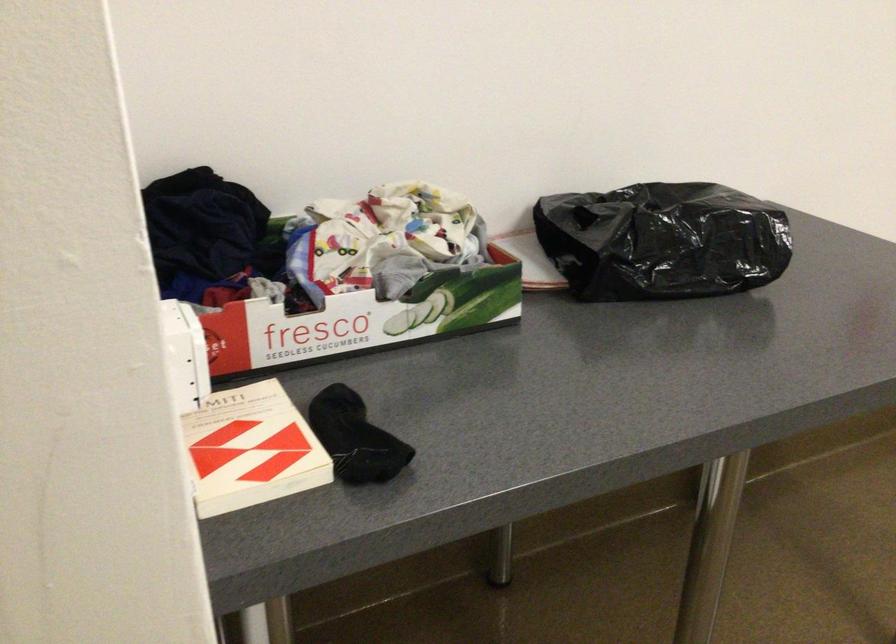
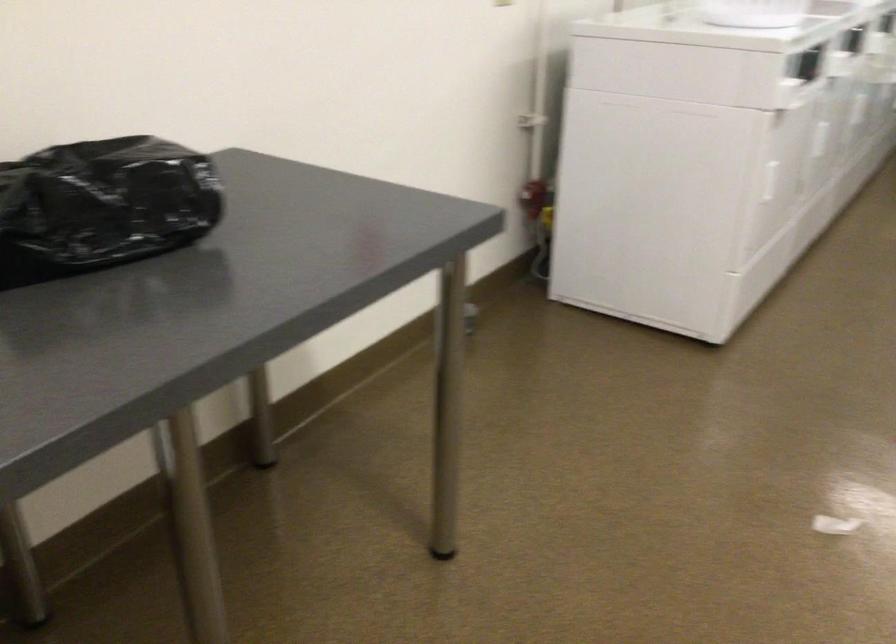
Question: The camera is either moving clockwise (left) or counter-clockwise (right) around the object. The first image is from the beginning of the video and the second image is from the end. Is the camera moving left or right when shooting the video?

Choices:
 (A) Left
 (B) Right

Answer: (A)